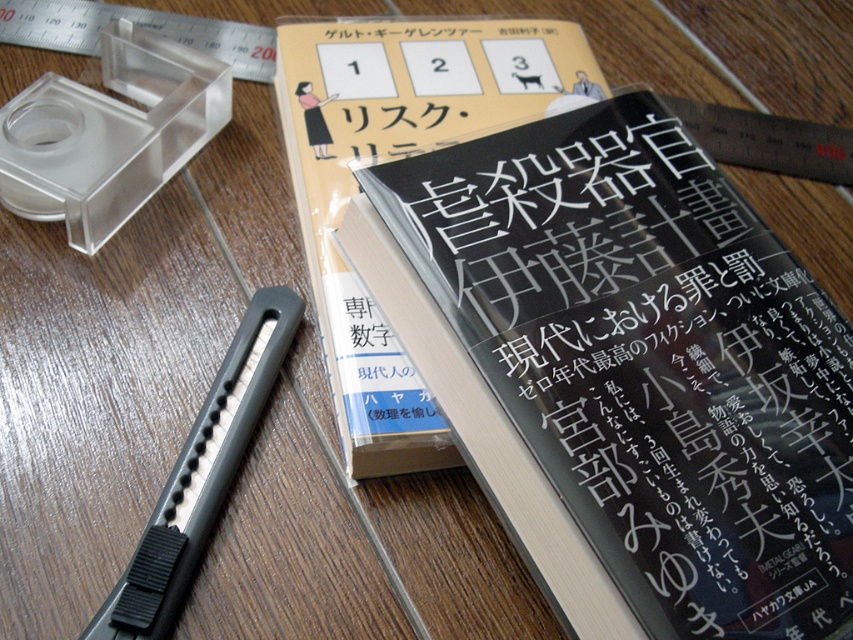
Which is more to the right, black glossy book at center or black matte book at center?

black glossy book at center

Consider the image. Does black glossy book at center have a greater height compared to black matte book at center?

Incorrect, black glossy book at center's height is not larger of black matte book at center's.

Who is more distant from viewer, (x=846, y=449) or (x=416, y=435)?

Point (x=416, y=435)

You are a GUI agent. You are given a task and a screenshot of the screen. Output one action in this format:
    pyautogui.click(x=<x>, y=<y>)
    Task: Click on the black glossy book at center
    The image size is (853, 640).
    Given the screenshot: What is the action you would take?
    pyautogui.click(x=625, y=371)